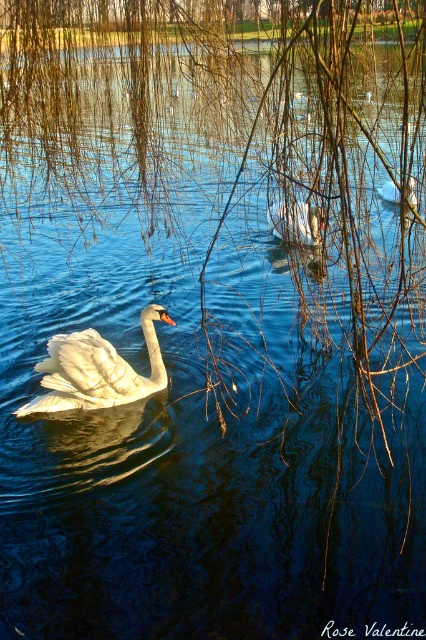
You are a photographer trying to capture both the white matte goose at center and the white matte duck at center in a single frame. Based on their sizes, which one should you focus on to ensure both fit comfortably in the shot?

The white matte goose at center might be wider than the white matte duck at center, so focusing on the goose would ensure both fit comfortably in the shot since it occupies more space.

You are a photographer trying to capture the white glossy swan at center and the white matte duck at center in the same frame. Based on their positions, which one would appear closer to the camera?

The white glossy swan at center is positioned under the white matte duck at center, so the white glossy swan at center would appear closer to the camera since it is lower in the frame.